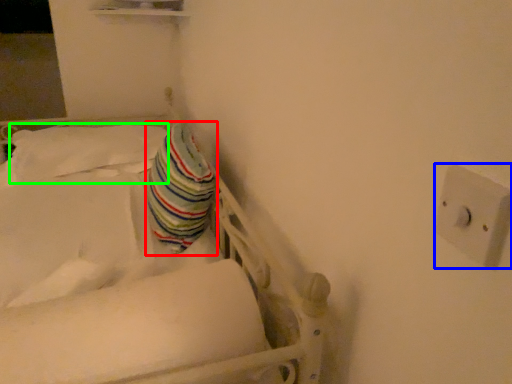
Question: Based on their relative distances, which object is farther from throw pillow (highlighted by a red box)? Choose from electric outlet (highlighted by a blue box) and pillow (highlighted by a green box).

Choices:
 (A) electric outlet
 (B) pillow

Answer: (A)